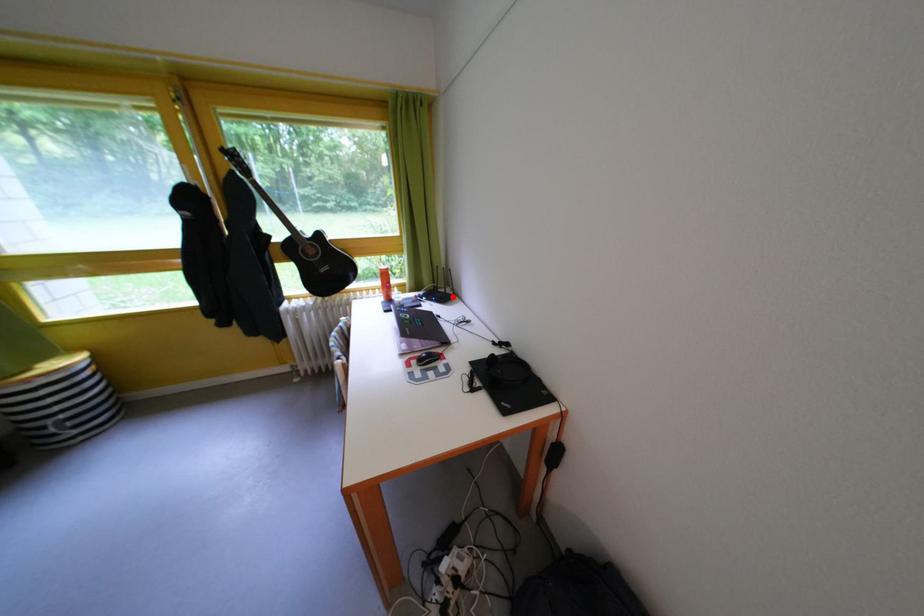
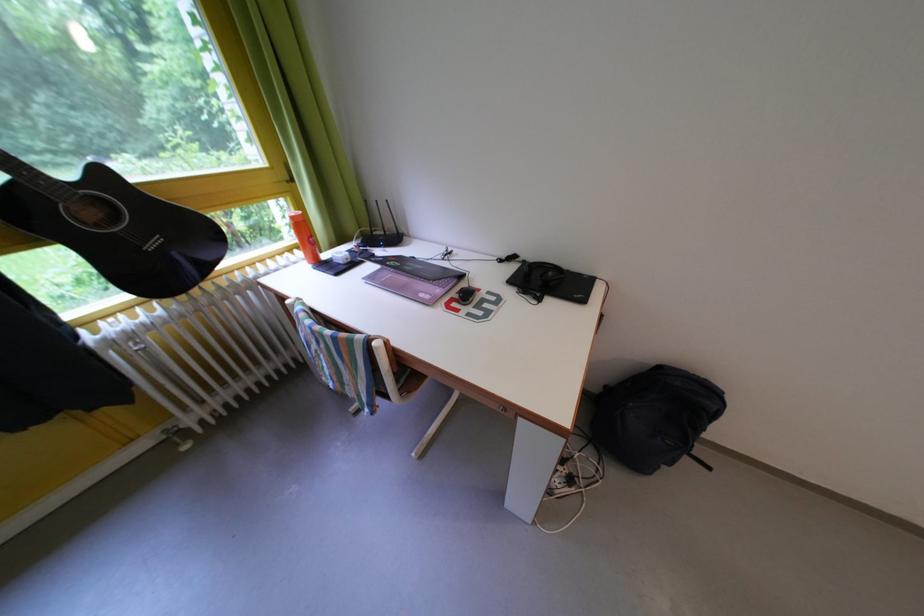
Question: I am providing you with two images of the same scene from different viewpoints. A red point is marked on the first image. Can you still see the location of the red point in image 2?

Choices:
 (A) Yes
 (B) No

Answer: (A)